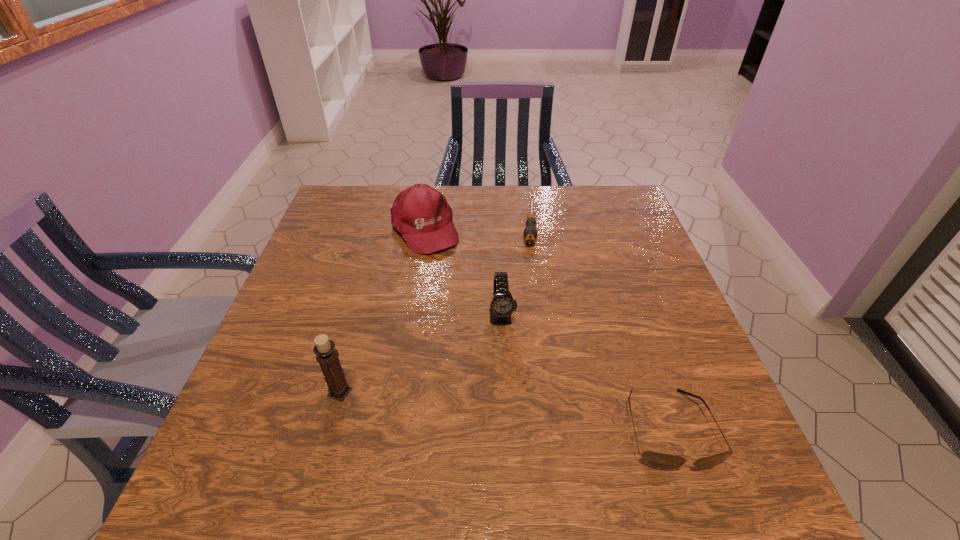
At what (x,y) coordinates should I click in order to perform the action: click on vacant area located at the tip of the fourth object from left to right. Please return your answer as a coordinate pair (x, y). Looking at the image, I should click on (527, 330).

The width and height of the screenshot is (960, 540). I want to click on vacant region located 0.140m at the tip of the fourth object from left to right, so click(x=530, y=283).

The width and height of the screenshot is (960, 540). What are the coordinates of `blank space located at the front of the baseball cap with the brim` in the screenshot? It's located at (455, 284).

Where is `free spot located 0.350m at the front of the baseball cap with the brim`? free spot located 0.350m at the front of the baseball cap with the brim is located at coordinates (494, 345).

The image size is (960, 540). Find the location of `blank area located 0.380m at the front of the baseball cap with the brim`. blank area located 0.380m at the front of the baseball cap with the brim is located at coordinates (501, 355).

I want to click on free spot located 0.150m on the face of the third farthest object, so click(510, 389).

Image resolution: width=960 pixels, height=540 pixels. Identify the location of blank area located on the face of the third farthest object. (510, 394).

The width and height of the screenshot is (960, 540). What are the coordinates of `free space located 0.110m on the face of the third farthest object` in the screenshot? It's located at (508, 373).

You are a GUI agent. You are given a task and a screenshot of the screen. Output one action in this format:
    pyautogui.click(x=<x>, y=<y>)
    Task: Click on the screwdriver situated at the far edge
    This screenshot has height=540, width=960.
    Given the screenshot: What is the action you would take?
    pyautogui.click(x=530, y=233)

The image size is (960, 540). I want to click on baseball cap located in the far edge section of the desktop, so (421, 214).